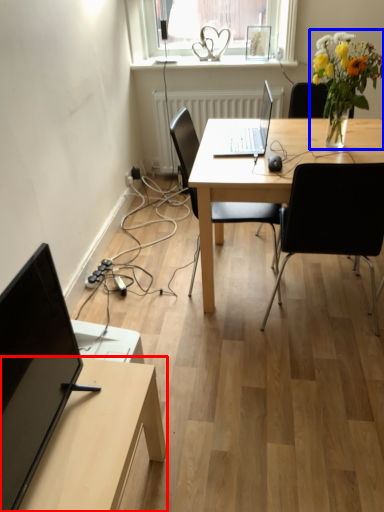
Question: Which of the following is the farthest to the observer, table (highlighted by a red box) or floral arrangement (highlighted by a blue box)?

Choices:
 (A) table
 (B) floral arrangement

Answer: (B)